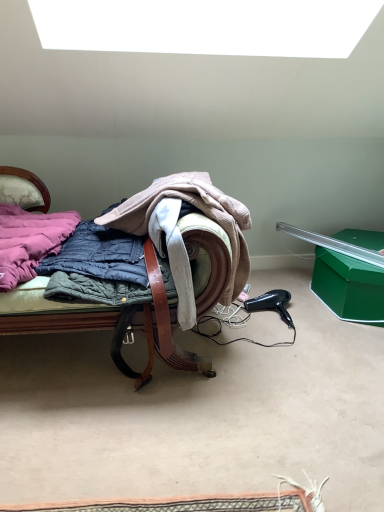
Where is `unoccupied space behind black plastic hair dryer at lower right`? The height and width of the screenshot is (512, 384). unoccupied space behind black plastic hair dryer at lower right is located at coordinates (280, 290).